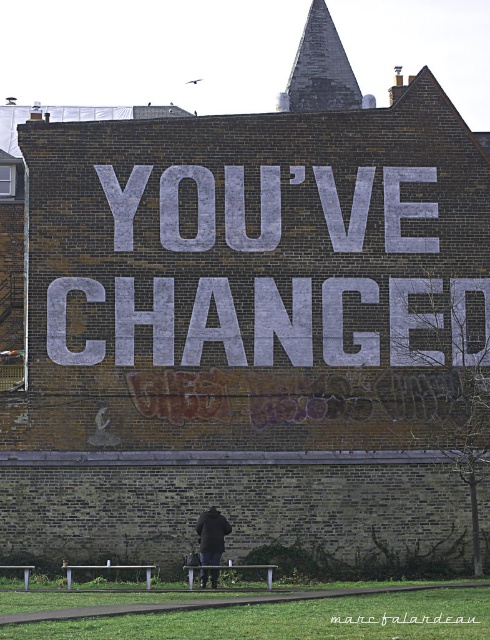
Question: Is the position of gray concrete text at center less distant than that of dark blue jacket at center?

Choices:
 (A) yes
 (B) no

Answer: (B)

Question: Is the position of gray concrete text at center more distant than that of dark blue jacket at center?

Choices:
 (A) yes
 (B) no

Answer: (A)

Question: Can you confirm if gray concrete text at center is wider than dark blue jacket at center?

Choices:
 (A) yes
 (B) no

Answer: (A)